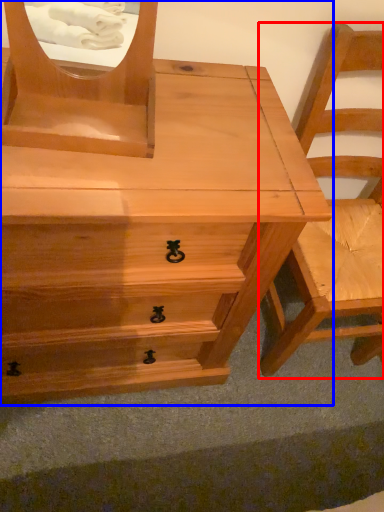
Question: Which object is further to the camera taking this photo, chair (highlighted by a red box) or chest of drawers (highlighted by a blue box)?

Choices:
 (A) chair
 (B) chest of drawers

Answer: (A)